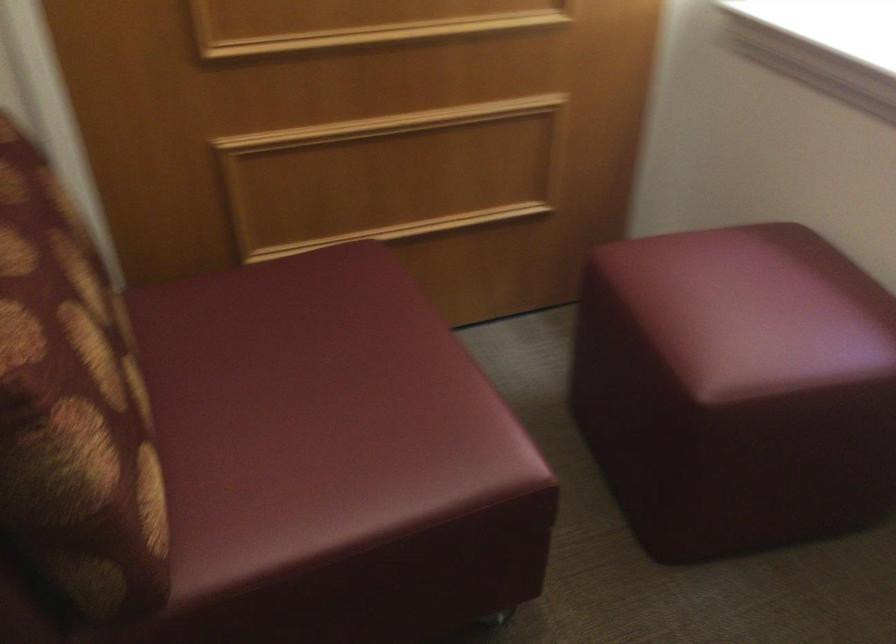
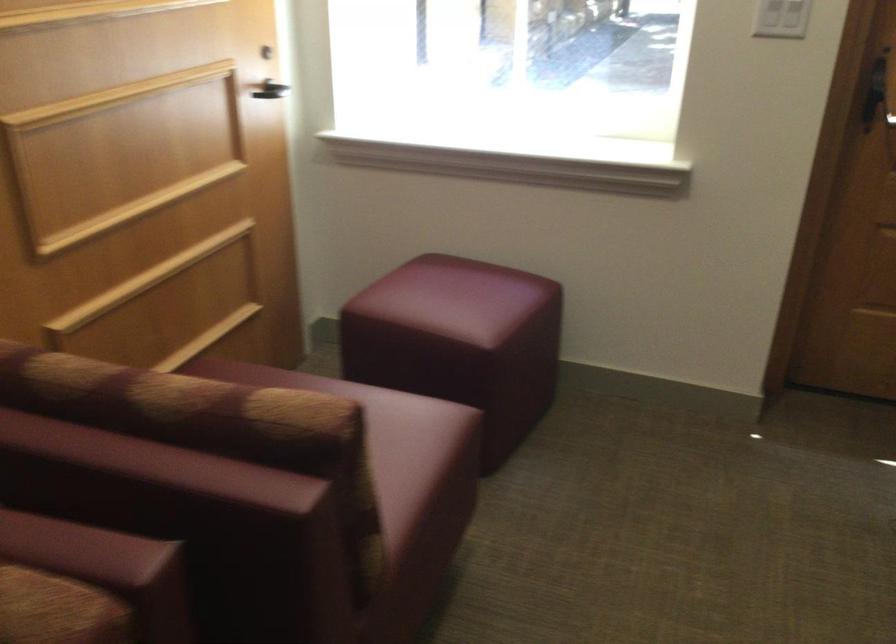
Locate, in the second image, the point that corresponds to point 677,366 in the first image.

(460, 342)